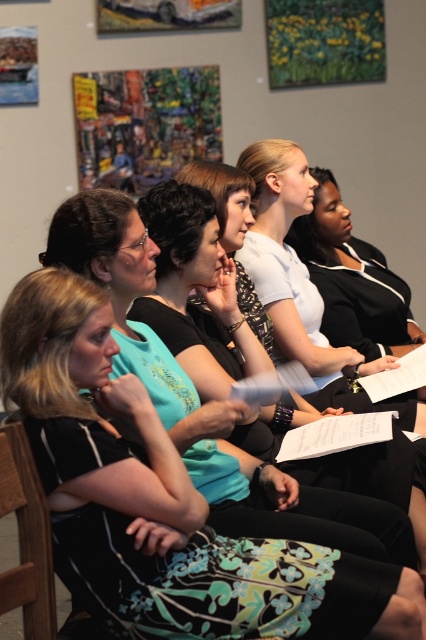
You are organizing a photoshoot and need to ensure that the matte black dress at center and the wooden at left are visible in the frame. Given their sizes, which object should you prioritize positioning closer to the camera to maintain clarity?

The matte black dress at center is larger in size than wooden at left, so you should prioritize positioning the matte black dress at center closer to the camera to maintain clarity.

You are an interior designer observing the scene. You need to place a new decorative item between the matte black dress at center and the wooden at left. Based on their positions, where should you place it?

The matte black dress at center is above the wooden at left. Therefore, the decorative item should be placed between them in the vertical space between the matte black dress at center and the wooden at left.

You are organizing a photo shoot and need to arrange two outfits on a mannequin stand. The stand can only hold items up to 1 meter in width. Given the matte black dress at center and the white matte shirt at center, which outfit should you choose to ensure it fits on the stand?

The white matte shirt at center should be chosen because if the matte black dress at center is wider than the white matte shirt at center, then the shirt is narrower and would fit within the 1 meter width limit of the stand.